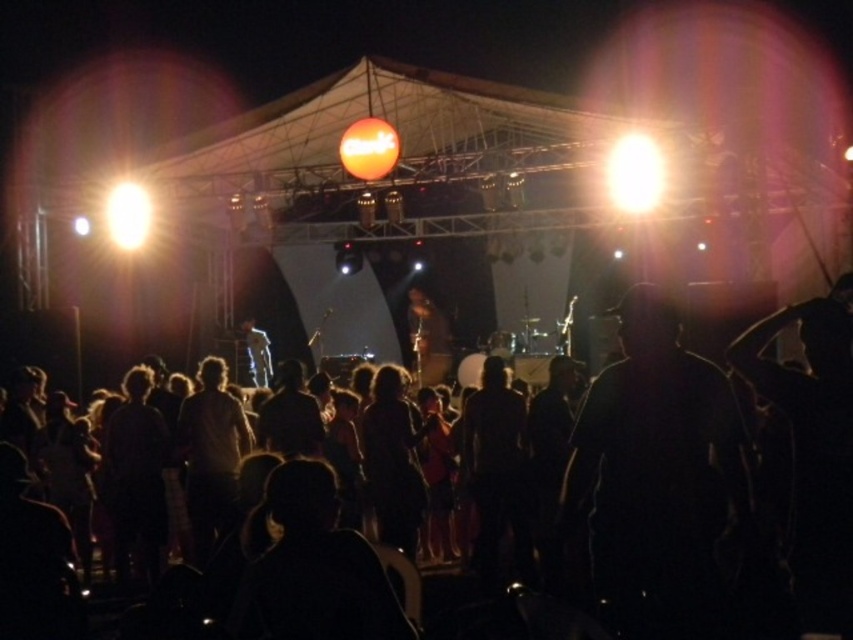
Question: Which point is closer to the camera taking this photo?

Choices:
 (A) (653, 323)
 (B) (437, 384)
 (C) (252, 356)
 (D) (798, 592)

Answer: (D)

Question: Can you confirm if dark fabric shirt at center is bigger than bright white light at upper right?

Choices:
 (A) yes
 (B) no

Answer: (B)

Question: Which point is closer to the camera?

Choices:
 (A) (659, 356)
 (B) (257, 348)
 (C) (595, 570)

Answer: (C)

Question: Among these points, which one is farthest from the camera?

Choices:
 (A) (668, 545)
 (B) (248, 364)
 (C) (114, 198)

Answer: (B)

Question: Can you confirm if orange matte sign at center is wider than matte black microphone at center?

Choices:
 (A) yes
 (B) no

Answer: (B)

Question: Does bright white light at upper right have a larger size compared to light blue denim jacket at center?

Choices:
 (A) yes
 (B) no

Answer: (A)